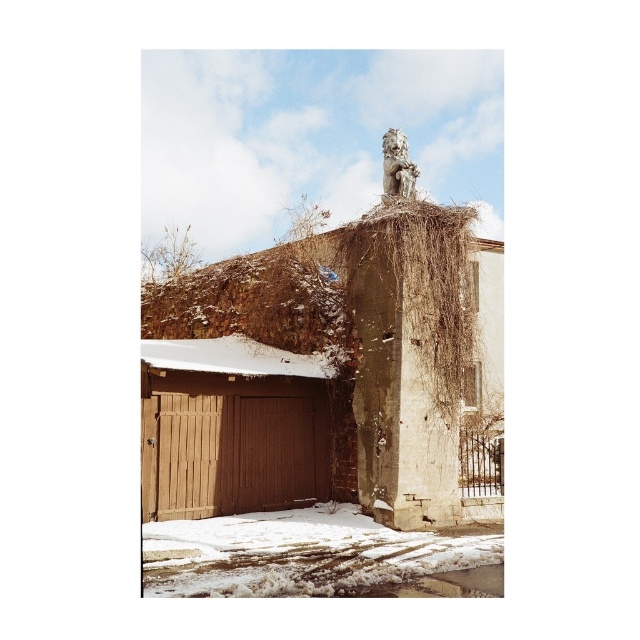
Where is `brown wood/glass garage at lower left`? This screenshot has height=640, width=640. brown wood/glass garage at lower left is located at coordinates (230, 428).

What do you see at coordinates (230, 428) in the screenshot? This screenshot has height=640, width=640. I see `brown wood/glass garage at lower left` at bounding box center [230, 428].

Between point (173, 465) and point (323, 360), which one is positioned in front?

Point (173, 465) is in front.

This screenshot has height=640, width=640. What are the coordinates of `brown wood/glass garage at lower left` in the screenshot? It's located at pos(230,428).

Does brown wooden hut at center have a smaller size compared to white matte roof at center?

No, brown wooden hut at center is not smaller than white matte roof at center.

Between point (310, 358) and point (252, 365), which one is positioned in front?

Point (252, 365) is more forward.

Does point (147, 356) come behind point (192, 362)?

That is False.

I want to click on brown wooden hut at center, so click(x=326, y=372).

From the picture: Does brown wooden hut at center have a greater height compared to brown wood/glass garage at lower left?

Indeed, brown wooden hut at center has a greater height compared to brown wood/glass garage at lower left.

Locate an element on the screen. The width and height of the screenshot is (640, 640). brown wooden hut at center is located at coordinates (326, 372).

Who is more forward, (x=353, y=266) or (x=285, y=394)?

Positioned in front is point (x=353, y=266).

This screenshot has width=640, height=640. What are the coordinates of `brown wooden hut at center` in the screenshot? It's located at (326, 372).